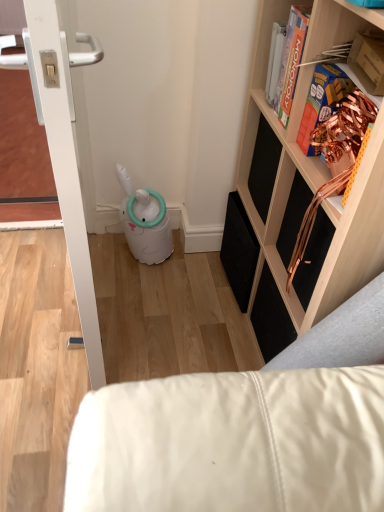
Find the location of a particular element. free space in front of white glossy door at left is located at coordinates (46, 380).